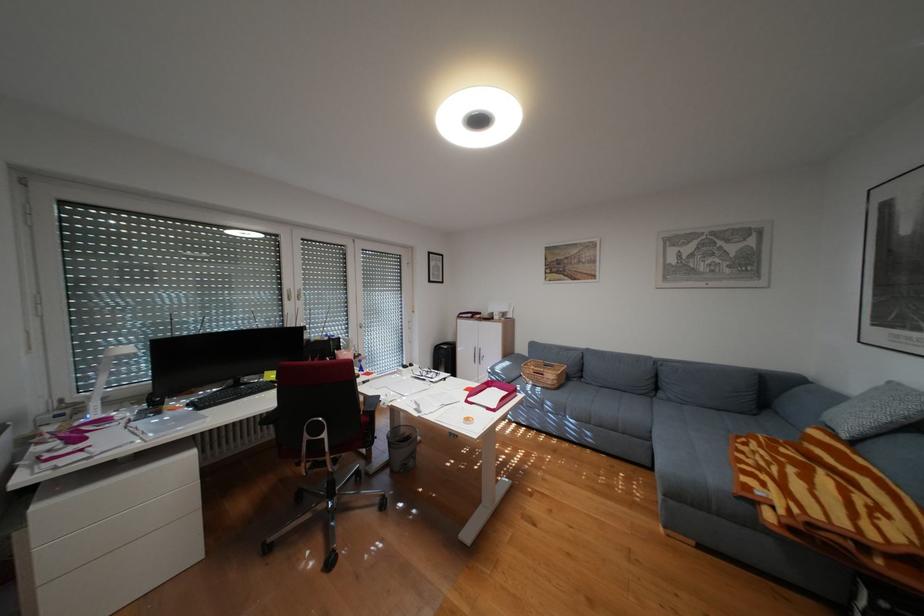
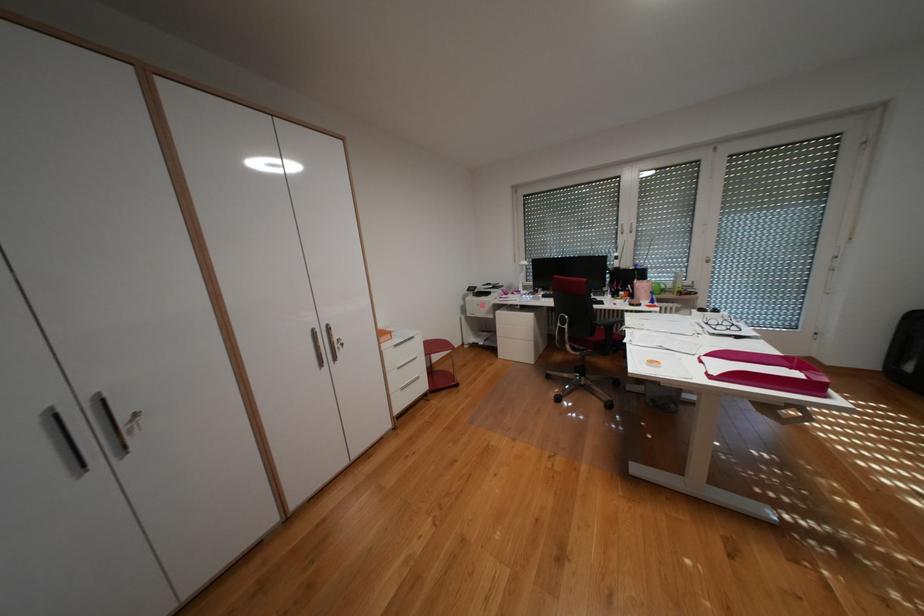
Where in the second image is the point corresponding to point (506, 410) from the first image?

(723, 377)